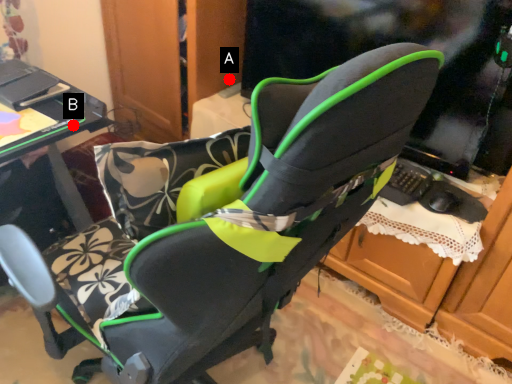
Question: Two points are circled on the image, labeled by A and B beside each circle. Which point is further to the camera?

Choices:
 (A) A is further
 (B) B is further

Answer: (A)